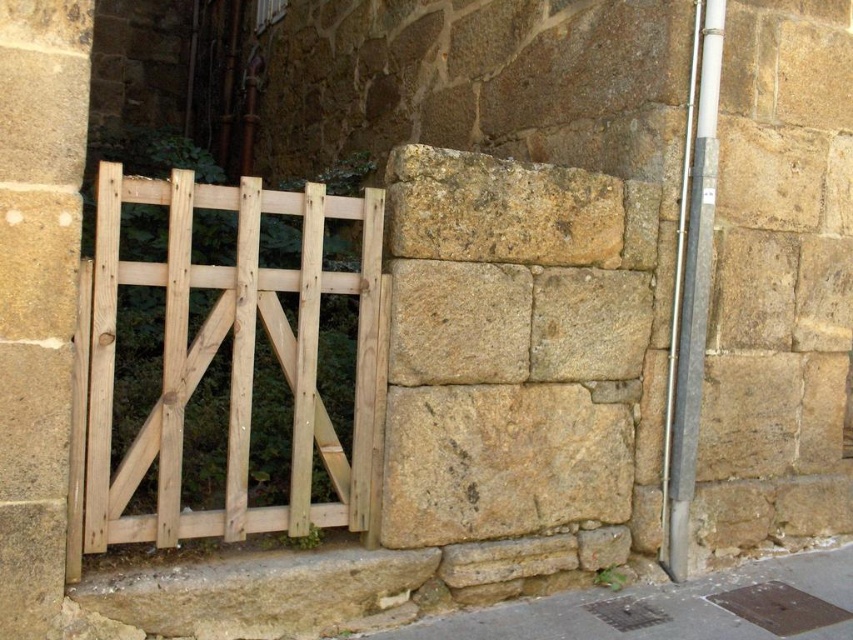
Between smooth stone pillar at left and gray concrete pole at right, which one is positioned higher?

gray concrete pole at right

Between smooth stone pillar at left and gray concrete pole at right, which one appears on the left side from the viewer's perspective?

From the viewer's perspective, smooth stone pillar at left appears more on the left side.

Is point (38, 605) closer to camera compared to point (683, 520)?

Yes, it is.

The image size is (853, 640). I want to click on smooth stone pillar at left, so click(x=38, y=294).

Between natural wood gate at left and brown stone wall at lower right, which one is positioned higher?

Positioned higher is natural wood gate at left.

Does natural wood gate at left have a smaller size compared to brown stone wall at lower right?

Actually, natural wood gate at left might be larger than brown stone wall at lower right.

You are a GUI agent. You are given a task and a screenshot of the screen. Output one action in this format:
    pyautogui.click(x=<x>, y=<y>)
    Task: Click on the natural wood gate at left
    The image size is (853, 640).
    Given the screenshot: What is the action you would take?
    pyautogui.click(x=230, y=365)

In the scene shown: Is brown stone wall at lower right positioned behind gray concrete pole at right?

No.

Is brown stone wall at lower right bigger than gray concrete pole at right?

Indeed, brown stone wall at lower right has a larger size compared to gray concrete pole at right.

Does point (698, 593) come behind point (688, 310)?

No, it is in front of (688, 310).

In order to click on brown stone wall at lower right in this screenshot , I will do `click(675, 608)`.